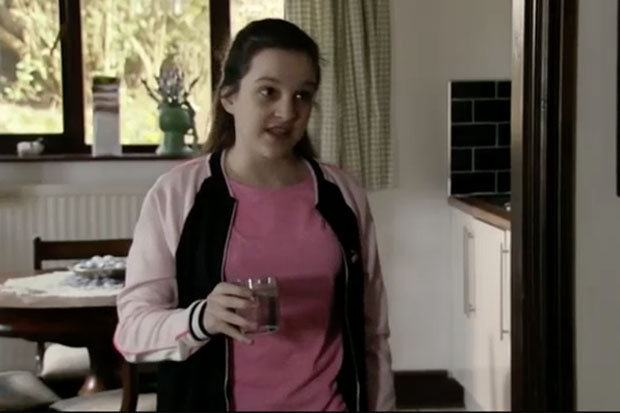
Image resolution: width=620 pixels, height=413 pixels. I want to click on cabinet pulls, so click(x=465, y=260), click(x=502, y=293).